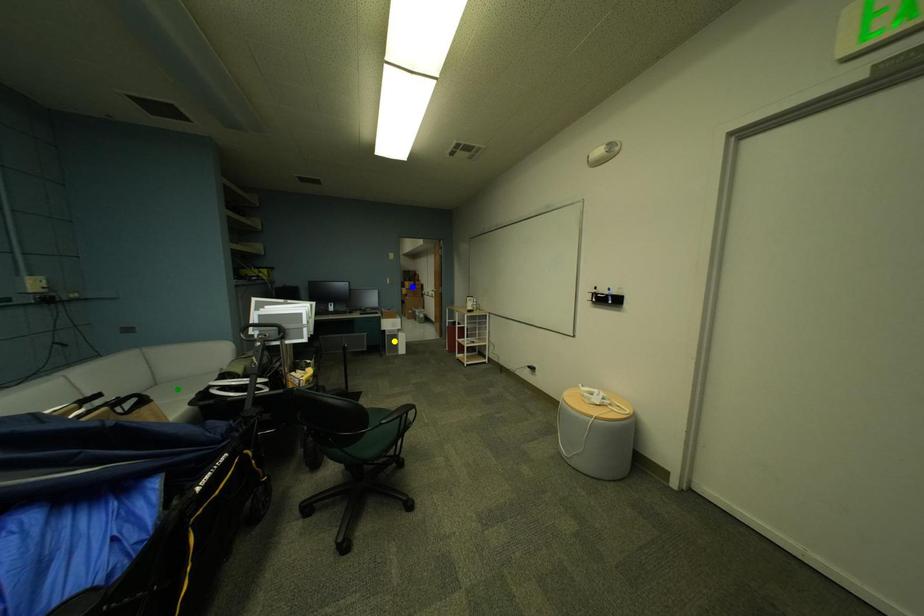
Order these from nearest to farthest:
yellow point, green point, blue point

green point
yellow point
blue point